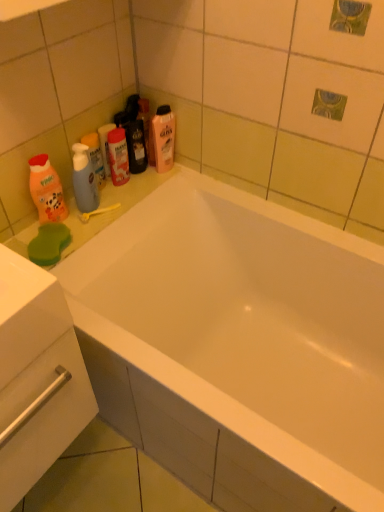
You are a GUI agent. You are given a task and a screenshot of the screen. Output one action in this format:
    pyautogui.click(x=<x>, y=<y>)
    Task: Click on the free space between translucent plastic bottle at upper center, the 2th cleaning product when ordered from left to right, and yellow plastic toothbrush at upper left
    
    Given the screenshot: What is the action you would take?
    pyautogui.click(x=133, y=190)